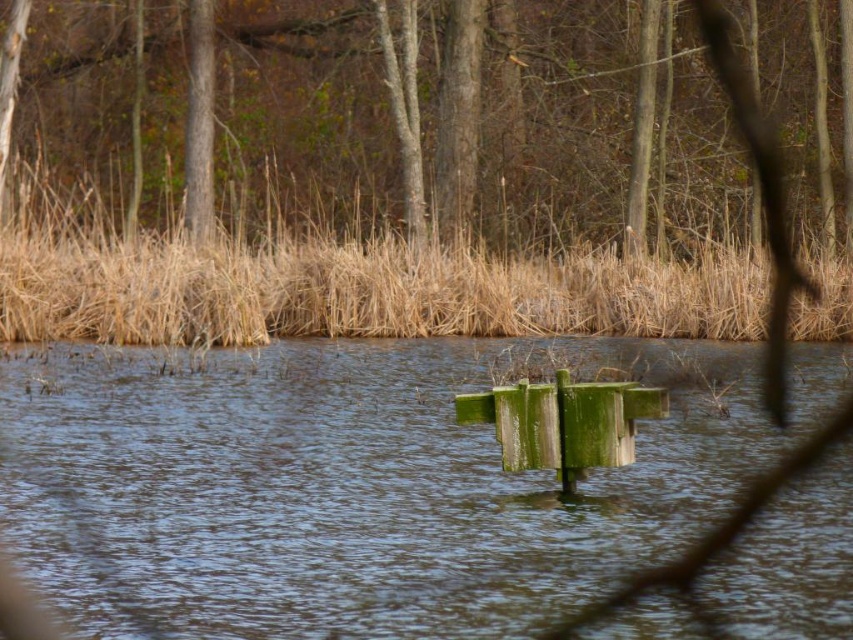
Is green mossy wood at center thinner than brown dry reed at upper center?

Yes.

Which of these two, green mossy wood at center or brown dry reed at upper center, stands shorter?

green mossy wood at center

Identify the location of green mossy wood at center. The image size is (853, 640). (352, 486).

This screenshot has height=640, width=853. I want to click on green mossy wood at center, so click(352, 486).

Does green mossy wood at center have a greater height compared to brown wood tree at upper center?

No.

Find the location of a particular element. This screenshot has width=853, height=640. green mossy wood at center is located at coordinates (352, 486).

What do you see at coordinates (573, 124) in the screenshot? The width and height of the screenshot is (853, 640). I see `brown wood tree at upper center` at bounding box center [573, 124].

From the picture: Is the position of brown wood tree at upper center less distant than that of brown dry reed at upper center?

No, it is behind brown dry reed at upper center.

You are a GUI agent. You are given a task and a screenshot of the screen. Output one action in this format:
    pyautogui.click(x=<x>, y=<y>)
    Task: Click on the brown wood tree at upper center
    The width and height of the screenshot is (853, 640).
    Given the screenshot: What is the action you would take?
    pyautogui.click(x=573, y=124)